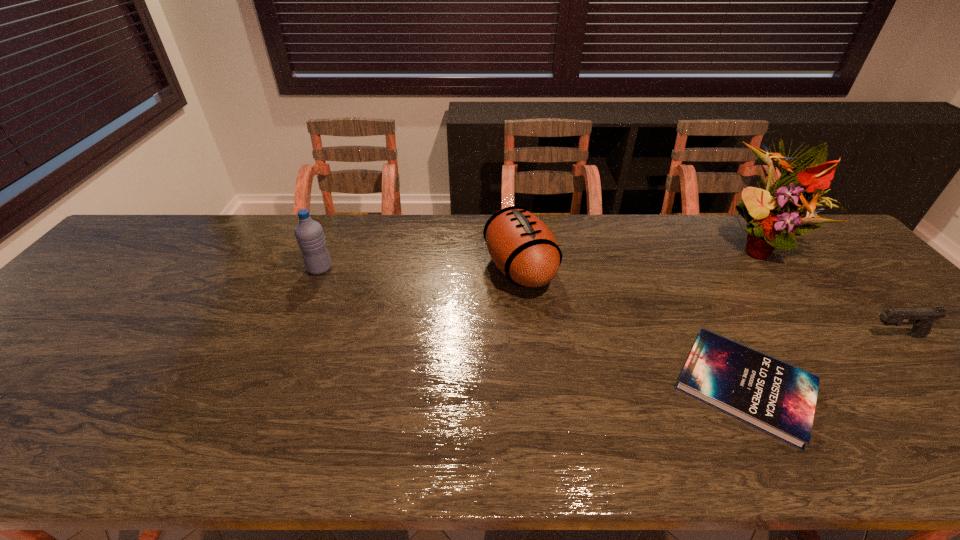
Where is `vacant space that's between the bouquet and the football (American)`? The height and width of the screenshot is (540, 960). vacant space that's between the bouquet and the football (American) is located at coordinates (639, 257).

Find the location of `unoccupied position between the pistol and the bouquet`. unoccupied position between the pistol and the bouquet is located at coordinates (827, 291).

Locate an element on the screen. free point between the pistol and the shortest object is located at coordinates (820, 361).

You are a GUI agent. You are given a task and a screenshot of the screen. Output one action in this format:
    pyautogui.click(x=<x>, y=<y>)
    Task: Click on the object that is the second closest to the tallest object
    This screenshot has height=540, width=960.
    Given the screenshot: What is the action you would take?
    pyautogui.click(x=773, y=396)

You are a GUI agent. You are given a task and a screenshot of the screen. Output one action in this format:
    pyautogui.click(x=<x>, y=<y>)
    Task: Click on the object that is the second closest one to the pistol
    
    Given the screenshot: What is the action you would take?
    tap(772, 215)

Find the location of a particular element. The height and width of the screenshot is (540, 960). vacant space that satisfies the following two spatial constraints: 1. on the front side of the hardback book; 2. on the right side of the water bottle is located at coordinates (270, 386).